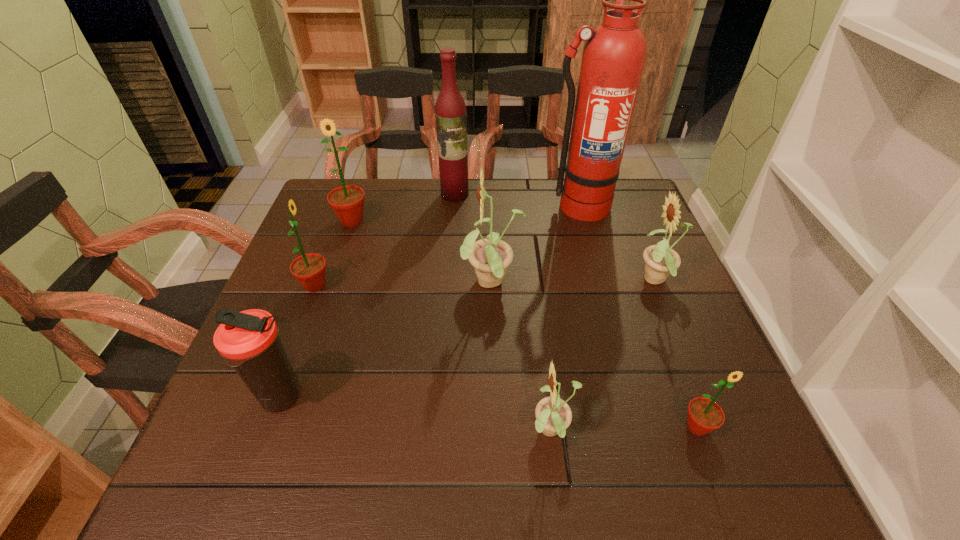
Where is `free spot located on the front-facing side of the rightmost yellow sunflower`? The width and height of the screenshot is (960, 540). free spot located on the front-facing side of the rightmost yellow sunflower is located at coordinates (482, 281).

Identify the location of free space located 0.330m on the face of the second farthest green sunflower. This screenshot has height=540, width=960. (472, 286).

Where is `vacant space located 0.280m on the right of the brown thermos bottle`? Image resolution: width=960 pixels, height=540 pixels. vacant space located 0.280m on the right of the brown thermos bottle is located at coordinates 458,398.

I want to click on vacant space located 0.060m on the front-facing side of the smallest yellow sunflower, so click(x=494, y=432).

This screenshot has height=540, width=960. What are the coordinates of `blank space located on the front-facing side of the smallest yellow sunflower` in the screenshot? It's located at (370, 432).

Identify the location of vacant space located on the front-facing side of the smallest yellow sunflower. point(449,432).

The image size is (960, 540). In order to click on vacant space located 0.050m on the face of the rightmost green sunflower in this screenshot , I will do `click(714, 472)`.

I want to click on fire extinguisher situated at the far edge, so click(614, 55).

Image resolution: width=960 pixels, height=540 pixels. What are the coordinates of `liquor that is at the far edge` in the screenshot? It's located at (450, 109).

Identify the location of sunflower located at the far edge. (347, 202).